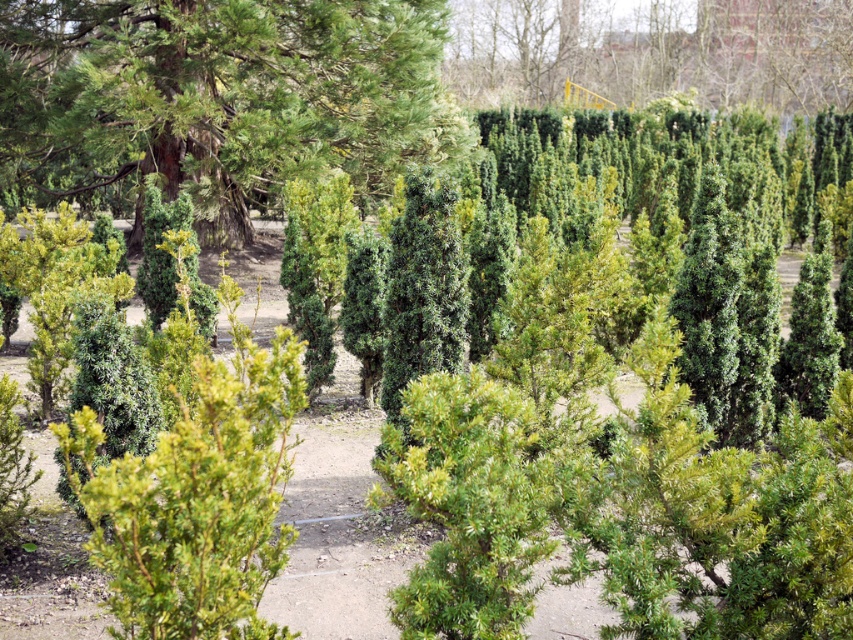
Can you confirm if green textured tree at upper left is positioned to the right of green textured hedge at upper center?

A: In fact, green textured tree at upper left is to the left of green textured hedge at upper center.

This screenshot has height=640, width=853. In order to click on green textured tree at upper left in this screenshot , I will do `click(218, 100)`.